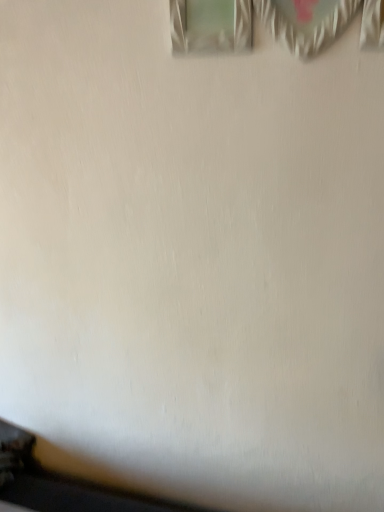
In order to face metallic silver curtain at upper center, should I rotate leftwards or rightwards?

To face it directly, rotate right by 14.781 degrees.

This screenshot has height=512, width=384. What do you see at coordinates (210, 26) in the screenshot?
I see `metallic silver curtain at upper center` at bounding box center [210, 26].

Looking at this image, measure the distance between point (383, 38) and camera.

Point (383, 38) is 28.62 inches from camera.

Where is `metallic silver curtain at upper center`? The width and height of the screenshot is (384, 512). metallic silver curtain at upper center is located at coordinates (210, 26).

What are the coordinates of `metallic silver curtain at upper center` in the screenshot? It's located at (210, 26).